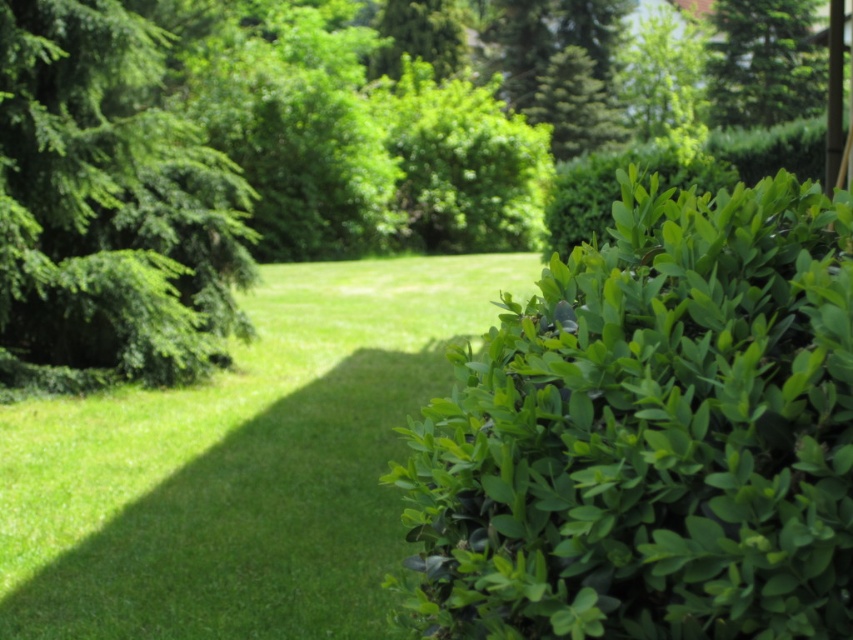
Question: Is the position of green leafy bush at right more distant than that of green leafy bush at center?

Choices:
 (A) no
 (B) yes

Answer: (A)

Question: Can you confirm if green leafy grass at center is wider than green leafy bush at center?

Choices:
 (A) yes
 (B) no

Answer: (A)

Question: Which of the following is the closest to the observer?

Choices:
 (A) green leafy bush at right
 (B) green leafy bush at upper center
 (C) green leafy bush at upper right

Answer: (A)

Question: Which of these objects is positioned farthest from the green leafy bush at upper right?

Choices:
 (A) green leafy tree at left
 (B) green leafy grass at center
 (C) green leafy bush at right

Answer: (C)

Question: Observing the image, what is the correct spatial positioning of green leafy grass at center in reference to green leafy bush at center?

Choices:
 (A) below
 (B) above

Answer: (A)

Question: Which point is closer to the camera taking this photo?

Choices:
 (A) (210, 522)
 (B) (416, 52)
 (C) (160, 195)

Answer: (A)